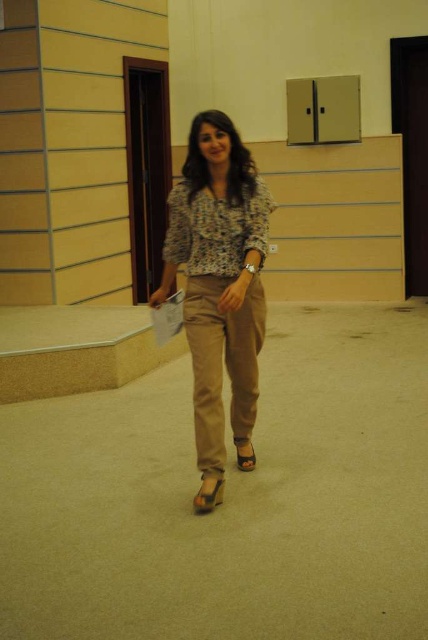
Question: Is tan cotton pants at center bigger than shiny gold sandal at center?

Choices:
 (A) yes
 (B) no

Answer: (A)

Question: Which of the following is the farthest from the observer?

Choices:
 (A) (193, 138)
 (B) (247, 465)

Answer: (B)

Question: Estimate the real-world distances between objects in this image. Which object is closer to the shiny gold sandal at center?

Choices:
 (A) brown suede sandal at lower center
 (B) tan cotton pants at center
 (C) matte floral blouse at center
 (D) floral print blouse at center

Answer: (A)

Question: Can you confirm if matte floral blouse at center is thinner than tan cotton pants at center?

Choices:
 (A) no
 (B) yes

Answer: (A)

Question: Can you confirm if matte floral blouse at center is positioned to the left of tan cotton pants at center?

Choices:
 (A) yes
 (B) no

Answer: (A)

Question: Which point is closer to the camera taking this photo?

Choices:
 (A) (208, 301)
 (B) (205, 477)
 (C) (247, 227)

Answer: (C)